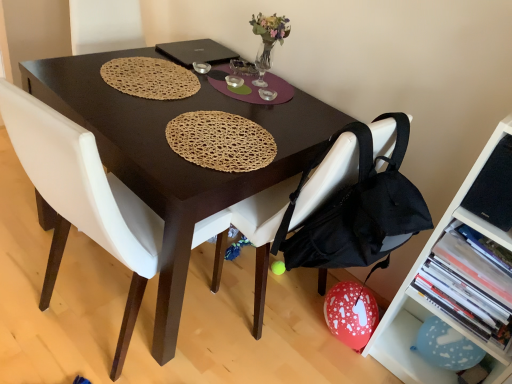
Question: Is translucent glass vase at upper center to the left of blue paper balloon at lower right, marked as the second shelf in a top-to-bottom arrangement, from the viewer's perspective?

Choices:
 (A) yes
 (B) no

Answer: (A)

Question: Is translucent glass vase at upper center thinner than blue paper balloon at lower right, marked as the second shelf in a top-to-bottom arrangement?

Choices:
 (A) no
 (B) yes

Answer: (A)

Question: Is there a large distance between translucent glass vase at upper center and blue paper balloon at lower right, which is the first shelf from bottom to top?

Choices:
 (A) no
 (B) yes

Answer: (B)

Question: Considering the relative positions of translucent glass vase at upper center and blue paper balloon at lower right, marked as the second shelf in a top-to-bottom arrangement, in the image provided, is translucent glass vase at upper center in front of blue paper balloon at lower right, marked as the second shelf in a top-to-bottom arrangement,?

Choices:
 (A) yes
 (B) no

Answer: (B)

Question: Is translucent glass vase at upper center to the right of blue paper balloon at lower right, which is the first shelf from bottom to top, from the viewer's perspective?

Choices:
 (A) no
 (B) yes

Answer: (A)

Question: Considering the positions of point (450, 208) and point (182, 48), is point (450, 208) closer or farther from the camera than point (182, 48)?

Choices:
 (A) farther
 (B) closer

Answer: (B)

Question: Would you say white plastic shelf at lower right, the second shelf when ordered from bottom to top, is to the left or to the right of black matte laptop at center in the picture?

Choices:
 (A) left
 (B) right

Answer: (B)

Question: Considering the positions of white plastic shelf at lower right, positioned as the first shelf in top-to-bottom order, and black matte laptop at center in the image, is white plastic shelf at lower right, positioned as the first shelf in top-to-bottom order, taller or shorter than black matte laptop at center?

Choices:
 (A) tall
 (B) short

Answer: (A)

Question: From a real-world perspective, is white plastic shelf at lower right, the second shelf when ordered from bottom to top, positioned above or below black matte laptop at center?

Choices:
 (A) below
 (B) above

Answer: (A)

Question: Which is correct: black fabric chair at lower right, which is the 1th chair in right-to-left order, is inside metallic silver bowl at center, or outside of it?

Choices:
 (A) outside
 (B) inside

Answer: (A)

Question: Is black fabric chair at lower right, which is the 1th chair in right-to-left order, in front of or behind metallic silver bowl at center in the image?

Choices:
 (A) behind
 (B) front

Answer: (B)

Question: Considering the positions of black fabric chair at lower right, the 2th chair in the left-to-right sequence, and metallic silver bowl at center in the image, is black fabric chair at lower right, the 2th chair in the left-to-right sequence, bigger or smaller than metallic silver bowl at center?

Choices:
 (A) big
 (B) small

Answer: (A)

Question: Looking at their shapes, would you say black fabric chair at lower right, the 2th chair in the left-to-right sequence, is wider or thinner than metallic silver bowl at center?

Choices:
 (A) wide
 (B) thin

Answer: (A)

Question: Is white leather chair at center, which is the 2th chair in right-to-left order, wider or thinner than black matte laptop at center?

Choices:
 (A) thin
 (B) wide

Answer: (B)

Question: From their relative heights in the image, would you say white leather chair at center, the first chair viewed from the left, is taller or shorter than black matte laptop at center?

Choices:
 (A) short
 (B) tall

Answer: (B)